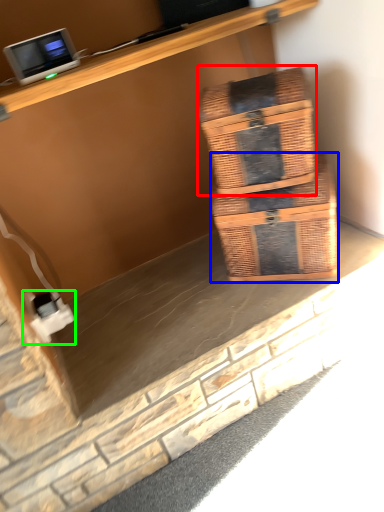
Question: Considering the real-world distances, which object is farthest from box (highlighted by a red box)? box (highlighted by a blue box) or electric outlet (highlighted by a green box)?

Choices:
 (A) box
 (B) electric outlet

Answer: (B)